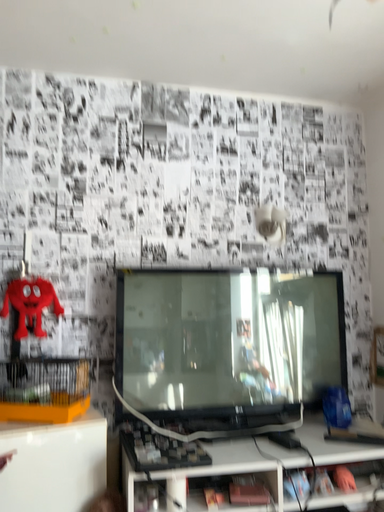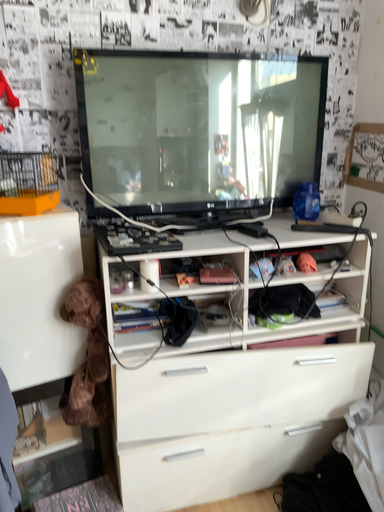
Question: How did the camera likely rotate when shooting the video?

Choices:
 (A) rotated downward
 (B) rotated upward

Answer: (A)